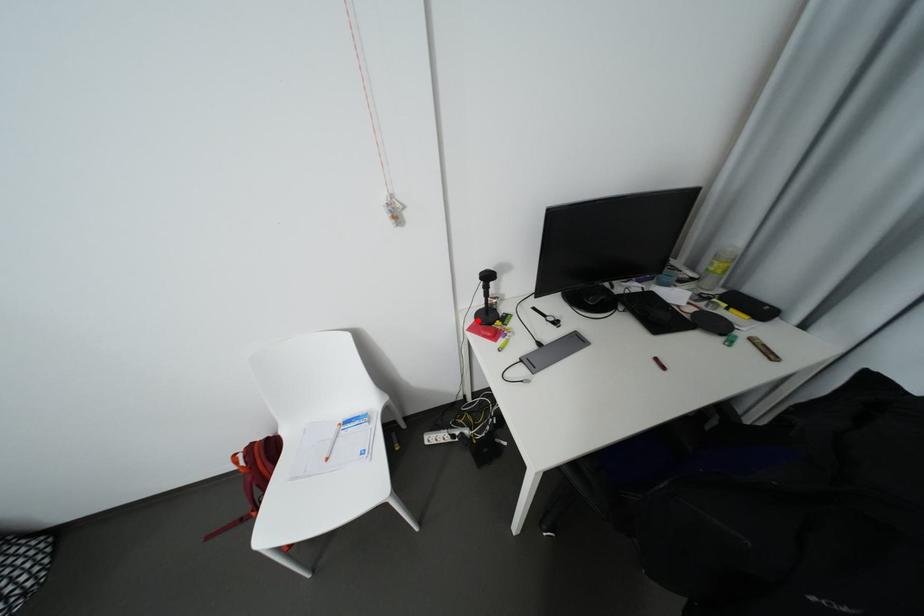
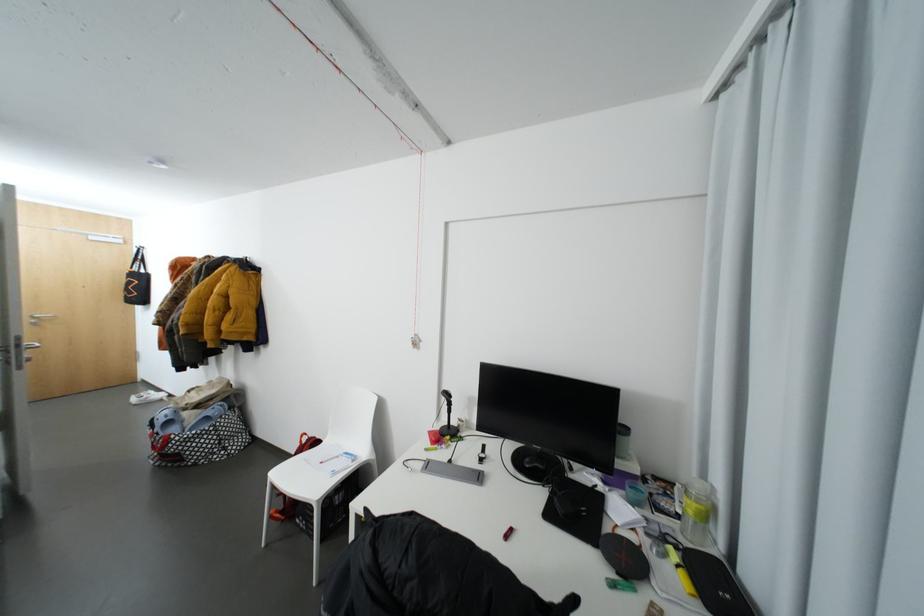
Question: I am providing you with two images of the same scene from different viewpoints. In image1, a red point is highlighted. Considering the same 3D point in image2, which of the following is correct?

Choices:
 (A) It is closer
 (B) It is farther

Answer: (B)